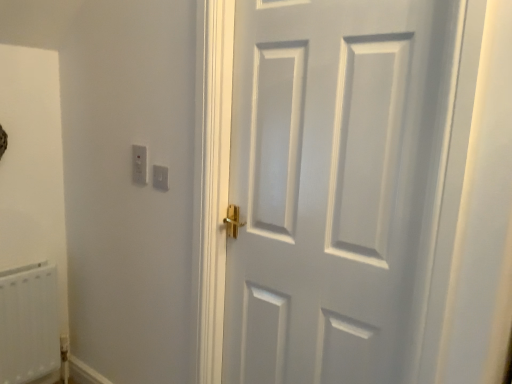
Question: From the image's perspective, is white plastic light switch at upper left positioned above or below white plastic radiator at lower left?

Choices:
 (A) above
 (B) below

Answer: (A)

Question: Considering the positions of white plastic light switch at upper left and white plastic radiator at lower left in the image, is white plastic light switch at upper left taller or shorter than white plastic radiator at lower left?

Choices:
 (A) short
 (B) tall

Answer: (A)

Question: Which of these objects is positioned closest to the white matte door at center?

Choices:
 (A) white plastic radiator at lower left
 (B) white plastic light switch at upper left

Answer: (B)

Question: Which of these objects is positioned farthest from the white plastic radiator at lower left?

Choices:
 (A) white plastic light switch at upper left
 (B) white matte door at center

Answer: (B)